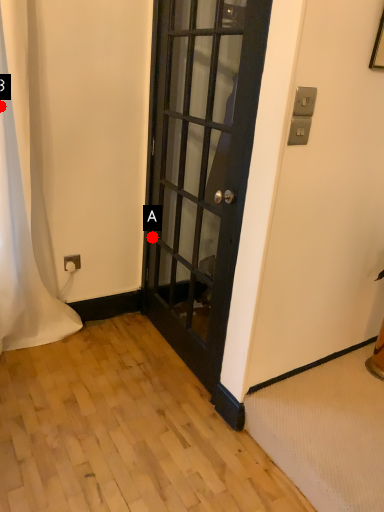
Question: Two points are circled on the image, labeled by A and B beside each circle. Which of the following is the farthest from the observer?

Choices:
 (A) A is further
 (B) B is further

Answer: (A)